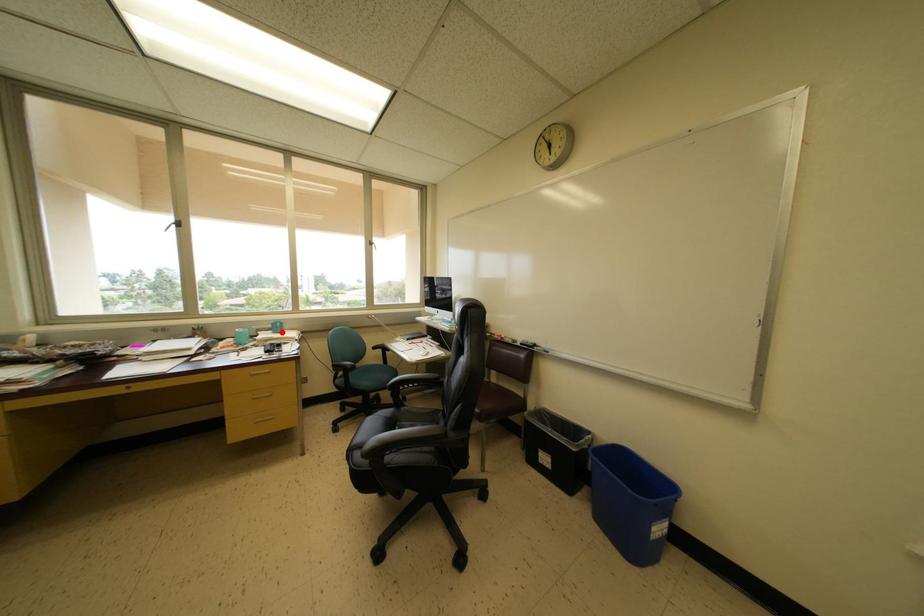
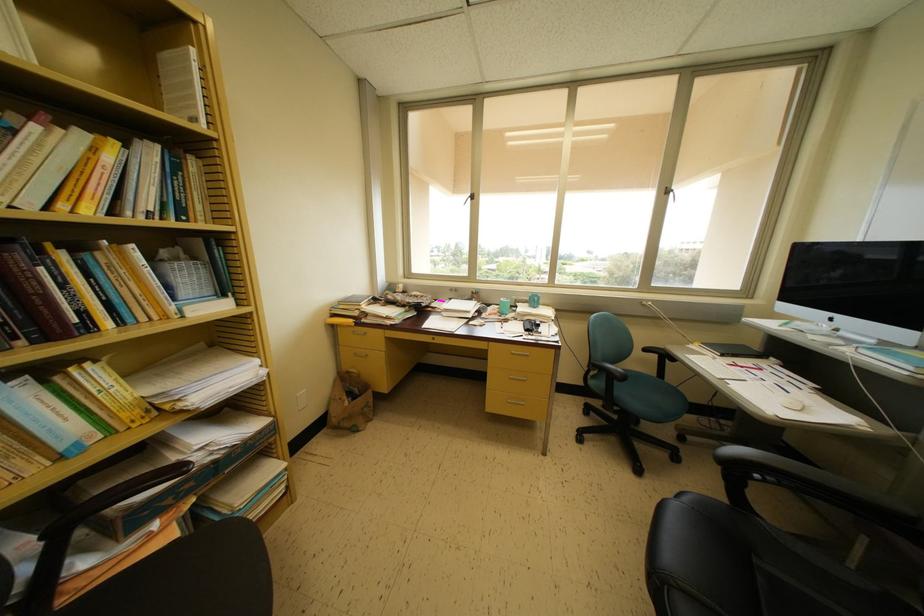
Where in the second image is the point corresponding to the highlighted location from the first image?

(538, 306)